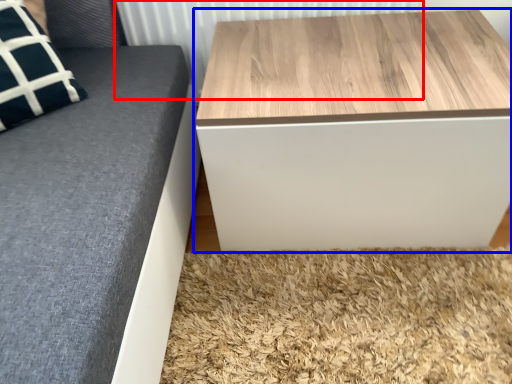
Question: Which point is closer to the camera, radiator (highlighted by a red box) or table (highlighted by a blue box)?

Choices:
 (A) radiator
 (B) table

Answer: (B)